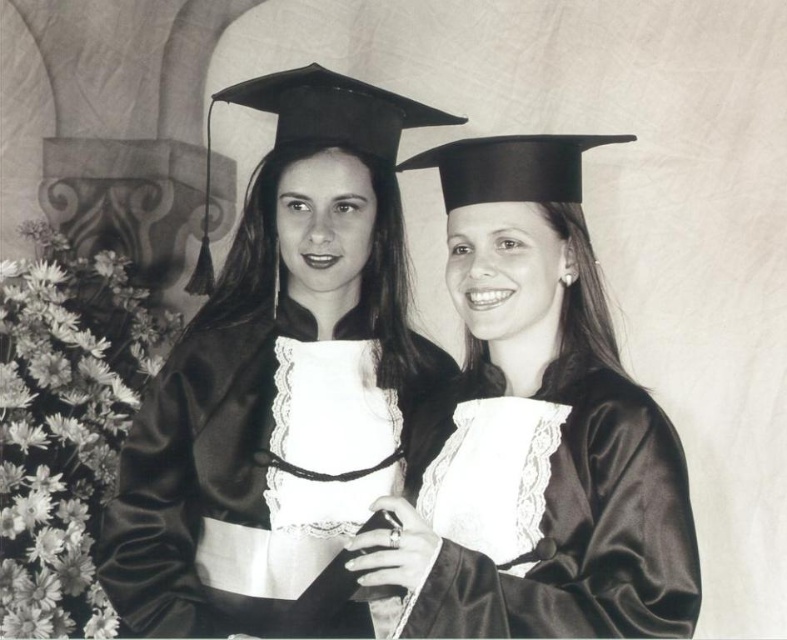
Is satin black gown at center smaller than satin black graduation gown at center?

No, satin black gown at center is not smaller than satin black graduation gown at center.

Is point (394, 214) in front of point (451, 292)?

No, (394, 214) is further to viewer.

Identify the location of satin black gown at center. This screenshot has width=787, height=640. (279, 376).